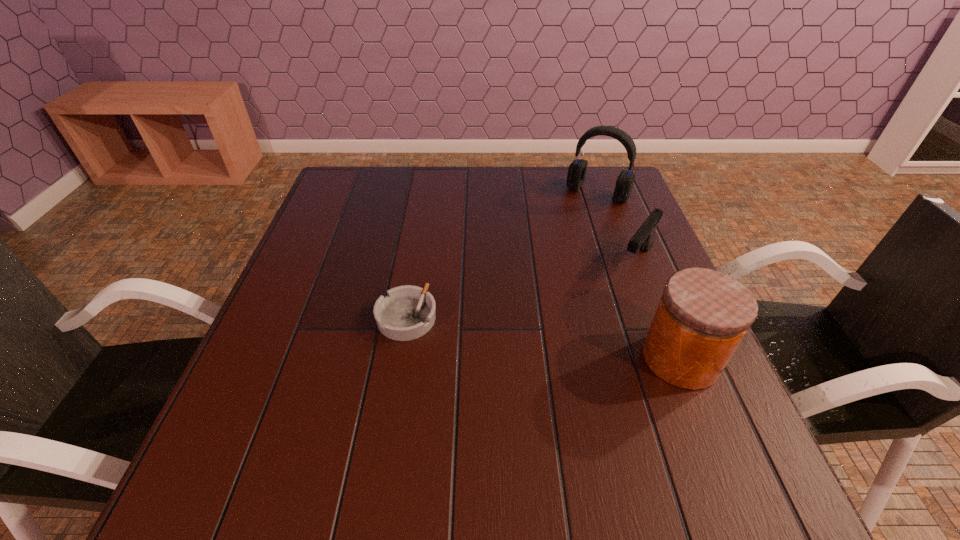
What are the coordinates of `free spot between the jar and the ashtray` in the screenshot? It's located at (543, 338).

Where is `vacant area between the second shortest object and the ashtray`? vacant area between the second shortest object and the ashtray is located at coordinates (521, 289).

Locate an element on the screen. free space between the farthest object and the pistol is located at coordinates (617, 226).

Image resolution: width=960 pixels, height=540 pixels. I want to click on vacant area that lies between the leftmost object and the pistol, so click(x=521, y=289).

This screenshot has width=960, height=540. In order to click on object that is the closest to the farthest object in this screenshot , I will do `click(643, 239)`.

Image resolution: width=960 pixels, height=540 pixels. I want to click on object identified as the third closest to the jar, so click(577, 169).

Where is `vacant space that satisfies the following two spatial constraints: 1. on the front side of the pistol; 2. on the right side of the farthest object`? vacant space that satisfies the following two spatial constraints: 1. on the front side of the pistol; 2. on the right side of the farthest object is located at coordinates (621, 260).